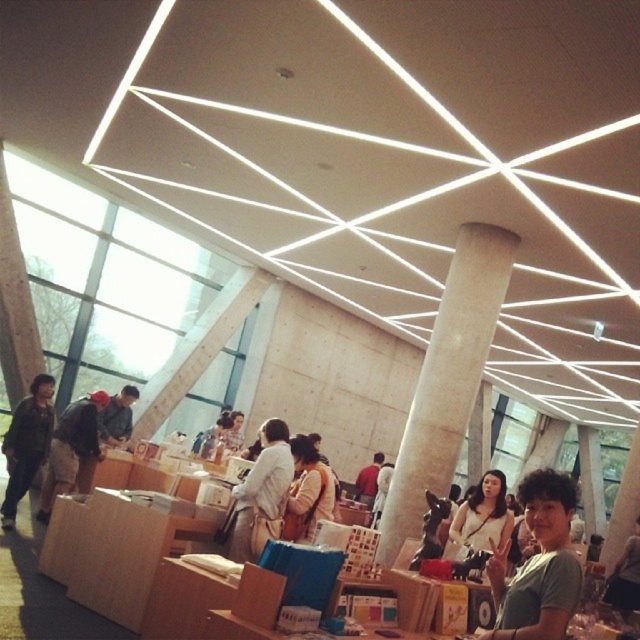
Question: Among these points, which one is nearest to the camera?

Choices:
 (A) (70, 442)
 (B) (45, 387)

Answer: (A)

Question: In this image, where is green t-shirt at center located relative to light brown fabric bag at center?

Choices:
 (A) below
 (B) above

Answer: (B)

Question: Which of the following is the closest to the observer?

Choices:
 (A) (358, 477)
 (B) (128, 424)

Answer: (B)

Question: From the image, what is the correct spatial relationship of green t-shirt at center in relation to red shirt at center?

Choices:
 (A) right
 (B) left

Answer: (A)

Question: In this image, where is matte white shirt at center located relative to matte gray shirt at center?

Choices:
 (A) below
 (B) above

Answer: (A)

Question: Which point is closer to the camera?

Choices:
 (A) white concrete pillar at center
 (B) light brown fabric bag at center
 (C) matte gray shirt at center

Answer: (A)